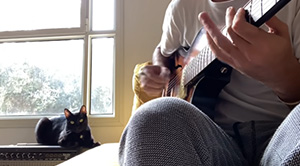
Locate an element on the screen. Image resolution: width=300 pixels, height=166 pixels. wall is located at coordinates (140, 35).